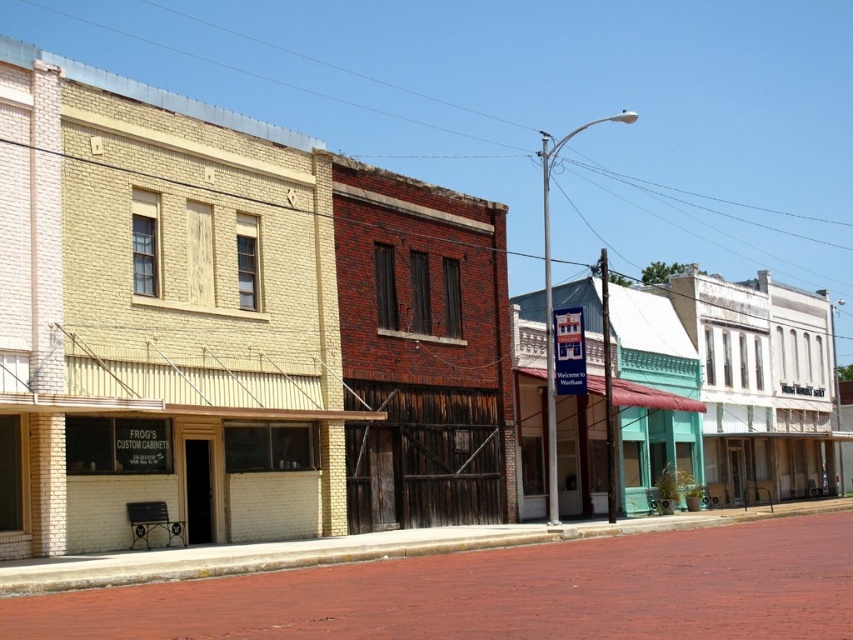
You are a delivery person trying to park your 1.8 meter wide delivery van on the street. The white wooden storefront at center and the green painted wood storefront at center are located along the street. Considering their sizes, will there be enough space between them to park your van?

The white wooden storefront at center is larger than the green painted wood storefront at center. Since the white wooden storefront at center is bigger, the space between them might be sufficient for your 1.8 meter wide van, but without exact measurements of the gap, it is uncertain. However, based on the size comparison alone, it is possible that there is enough space.

You are standing on the street and want to walk from point (788, 436) to point (647, 406). Which direction should you move?

Since point (788, 436) is closer to you than point (647, 406), you should move backward to reach it.

You are standing on the street and want to reach the white wooden storefront at center. According to the coordinates, where should you head to?

The white wooden storefront at center is located at coordinates point (769,465), so you should head to that point to reach it.